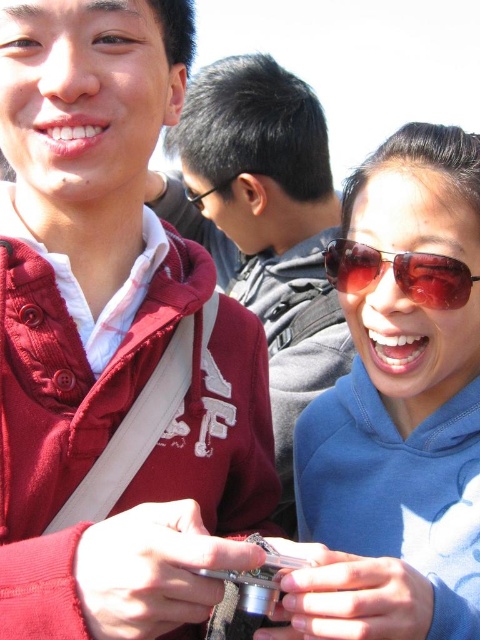
Question: Considering the real-world distances, which object is closest to the matte blue hoodie at center?

Choices:
 (A) matte red jacket at left
 (B) matte red hoodie at center

Answer: (A)

Question: Which of the following is the farthest from the observer?

Choices:
 (A) (403, 276)
 (B) (176, 227)

Answer: (B)

Question: Where is matte blue hoodie at center located in relation to shiny brown sunglasses at lower right in the image?

Choices:
 (A) right
 (B) left

Answer: (A)

Question: Estimate the real-world distances between objects in this image. Which object is farther from the matte red jacket at left?

Choices:
 (A) matte blue hoodie at center
 (B) shiny brown sunglasses at lower right
 (C) matte red hoodie at center

Answer: (C)

Question: Is matte blue hoodie at center to the left of matte red hoodie at center from the viewer's perspective?

Choices:
 (A) yes
 (B) no

Answer: (B)

Question: In this image, where is matte red jacket at left located relative to shiny brown sunglasses at lower right?

Choices:
 (A) right
 (B) left

Answer: (B)